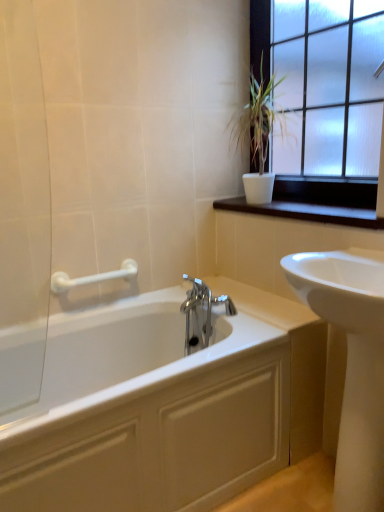
Where is `vacant space underneath white plastic grab bar at upper left (from a real-world perspective)`? The image size is (384, 512). vacant space underneath white plastic grab bar at upper left (from a real-world perspective) is located at coordinates (94, 305).